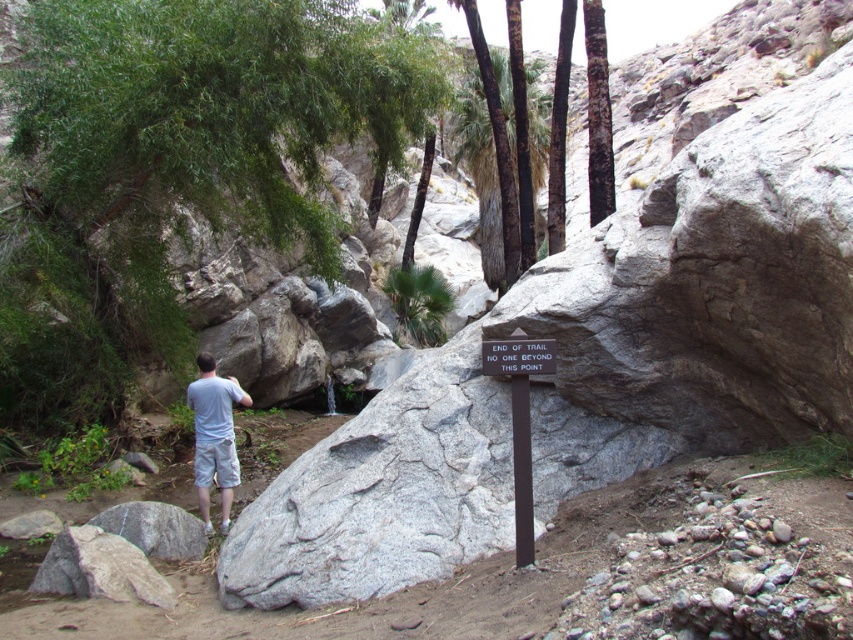
Looking at this image, you are a park ranger who needs to place a new sign between the smooth dark brown tree trunk at center and the green leafy palm tree at center. The sign requires 3 feet of space on all sides. Is there enough space between them to place the sign?

The distance between the smooth dark brown tree trunk at center and the green leafy palm tree at center is 26.00 feet. Subtracting the required 3 feet of space on both sides, the minimum needed space is 6 feet. Since 26 feet is greater than 6 feet, there is sufficient space to place the sign between them.

In the scene shown: You are a park ranger checking the trail markers. You notice the smooth dark brown tree trunk at center and the green leafy palm tree at center. Which tree has a wider trunk?

The smooth dark brown tree trunk at center has a wider trunk than the green leafy palm tree at center.